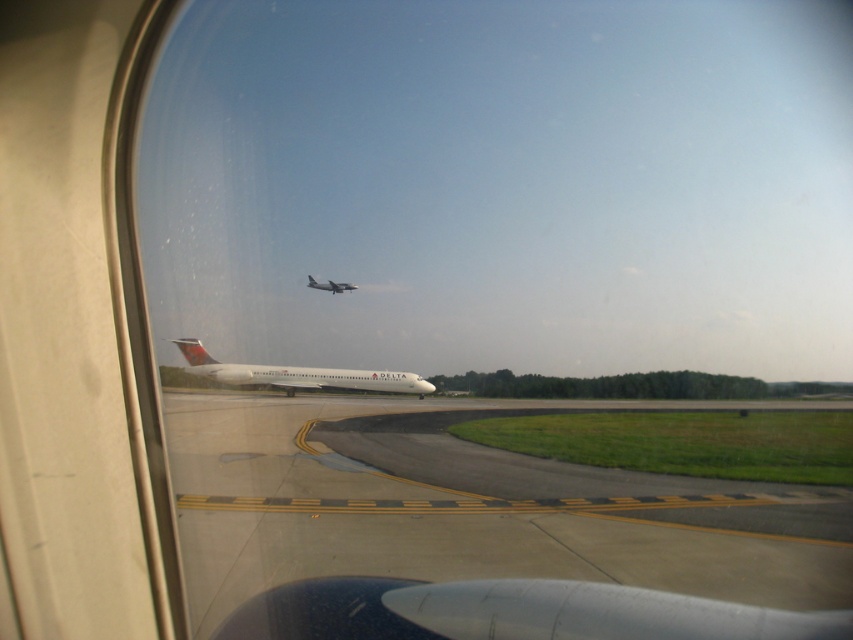
Between smooth asphalt tarmac at center and white glossy airplane at center, which one appears on the right side from the viewer's perspective?

Positioned to the right is smooth asphalt tarmac at center.

Locate an element on the screen. smooth asphalt tarmac at center is located at coordinates (469, 508).

Which is behind, point (532, 547) or point (340, 284)?

The point (340, 284) is more distant.

Does smooth asphalt tarmac at center have a greater height compared to white matte airplane at center?

Yes.

Where is `smooth asphalt tarmac at center`? smooth asphalt tarmac at center is located at coordinates (469, 508).

Does white glossy airplane at center have a lesser height compared to white matte airplane at center?

In fact, white glossy airplane at center may be taller than white matte airplane at center.

Between point (305, 385) and point (309, 285), which one is positioned behind?

The point (309, 285) is behind.

Who is more forward, (234, 384) or (309, 282)?

Positioned in front is point (234, 384).

Locate an element on the screen. This screenshot has height=640, width=853. white glossy airplane at center is located at coordinates (299, 374).